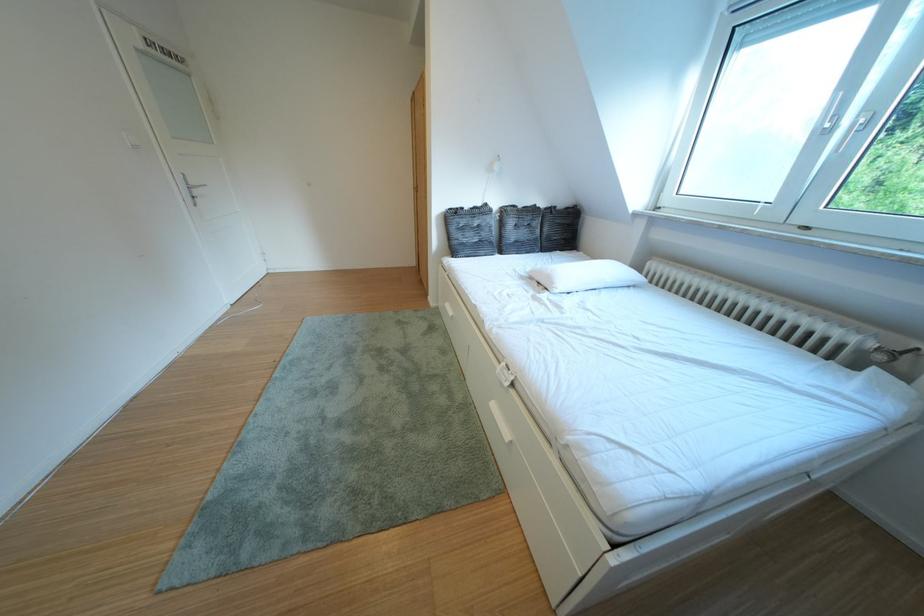
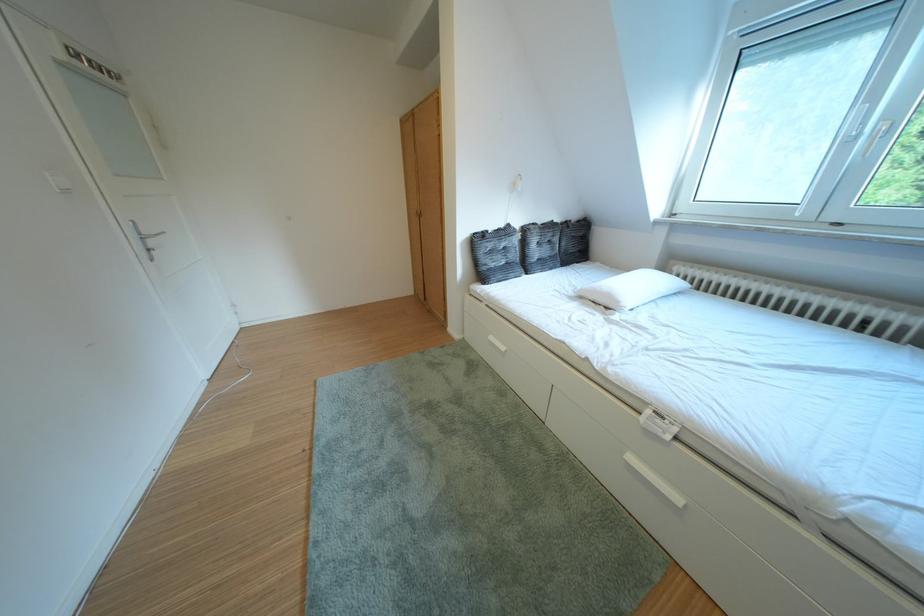
Where in the second image is the point corresponding to pixel 500 209 from the first image?

(523, 230)